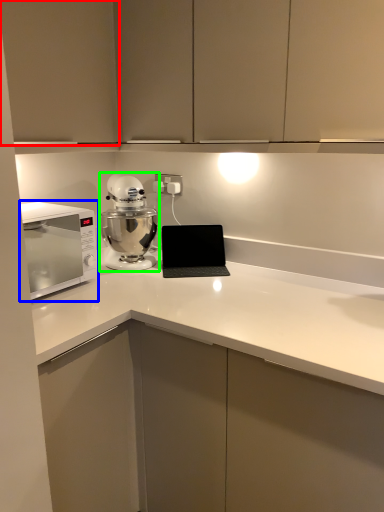
Question: Considering the real-world distances, which object is farthest from cabinetry (highlighted by a red box)? home appliance (highlighted by a blue box) or mixer (highlighted by a green box)?

Choices:
 (A) home appliance
 (B) mixer

Answer: (B)